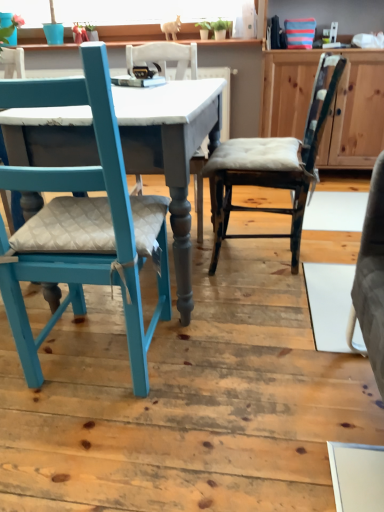
Question: Considering the relative positions of distressed wood chair at center, which appears as the first chair when viewed from the right, and matte gray table at center in the image provided, is distressed wood chair at center, which appears as the first chair when viewed from the right, to the left of matte gray table at center from the viewer's perspective?

Choices:
 (A) yes
 (B) no

Answer: (B)

Question: From a real-world perspective, is distressed wood chair at center, which appears as the first chair when viewed from the right, on top of matte gray table at center?

Choices:
 (A) no
 (B) yes

Answer: (B)

Question: From the image's perspective, is distressed wood chair at center, positioned as the second chair in left-to-right order, beneath matte gray table at center?

Choices:
 (A) no
 (B) yes

Answer: (A)

Question: Is distressed wood chair at center, positioned as the second chair in left-to-right order, bigger than matte gray table at center?

Choices:
 (A) yes
 (B) no

Answer: (B)

Question: Is point (243, 176) closer or farther from the camera than point (278, 94)?

Choices:
 (A) closer
 (B) farther

Answer: (A)

Question: Do you think distressed wood chair at center, which appears as the first chair when viewed from the right, is within wooden cabinet at center, or outside of it?

Choices:
 (A) inside
 (B) outside

Answer: (B)

Question: From a real-world perspective, relative to wooden cabinet at center, is distressed wood chair at center, positioned as the second chair in left-to-right order, vertically above or below?

Choices:
 (A) above
 (B) below

Answer: (B)

Question: In the image, is distressed wood chair at center, positioned as the second chair in left-to-right order, on the left side or the right side of wooden cabinet at center?

Choices:
 (A) left
 (B) right

Answer: (A)

Question: Looking at the image, does matte gray table at center seem bigger or smaller compared to wooden cabinet at center?

Choices:
 (A) small
 (B) big

Answer: (B)

Question: Considering the positions of point (59, 120) and point (332, 138), is point (59, 120) closer or farther from the camera than point (332, 138)?

Choices:
 (A) closer
 (B) farther

Answer: (A)

Question: Is matte gray table at center to the left or to the right of wooden cabinet at center in the image?

Choices:
 (A) right
 (B) left

Answer: (B)

Question: In terms of width, does matte gray table at center look wider or thinner when compared to wooden cabinet at center?

Choices:
 (A) thin
 (B) wide

Answer: (B)

Question: Choose the correct answer: Is teal painted wood chair at left, acting as the 1th chair starting from the left, inside distressed wood chair at center, which appears as the first chair when viewed from the right, or outside it?

Choices:
 (A) inside
 (B) outside

Answer: (B)

Question: From a real-world perspective, is teal painted wood chair at left, acting as the 1th chair starting from the left, above or below distressed wood chair at center, positioned as the second chair in left-to-right order?

Choices:
 (A) above
 (B) below

Answer: (A)